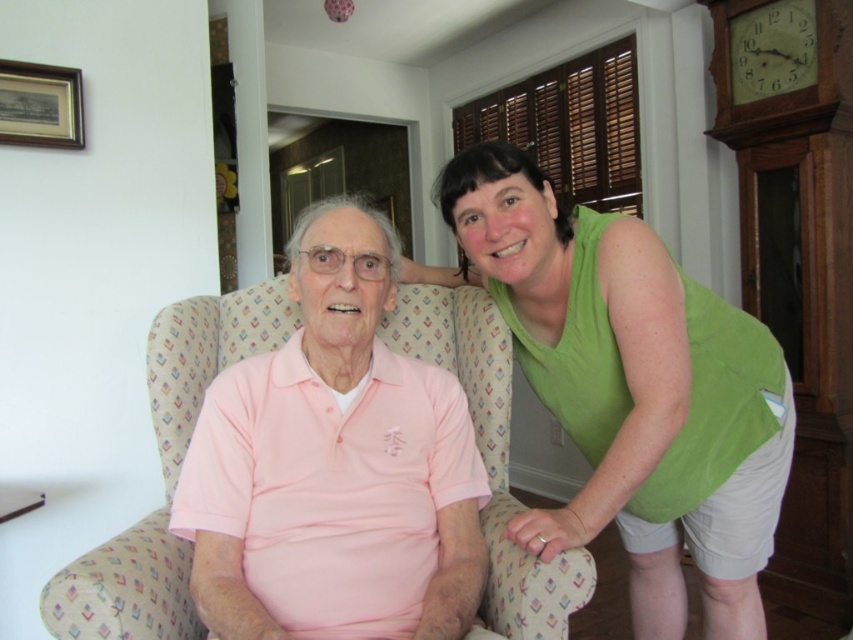
Who is lower down, green sleeveless top at upper right or wooden clock at upper right?

Positioned lower is green sleeveless top at upper right.

Does green sleeveless top at upper right appear on the right side of wooden clock at upper right?

In fact, green sleeveless top at upper right is to the left of wooden clock at upper right.

Identify the location of green sleeveless top at upper right. The height and width of the screenshot is (640, 853). (631, 388).

You are a GUI agent. You are given a task and a screenshot of the screen. Output one action in this format:
    pyautogui.click(x=<x>, y=<y>)
    Task: Click on the green sleeveless top at upper right
    
    Given the screenshot: What is the action you would take?
    pyautogui.click(x=631, y=388)

Based on the photo, is pink fabric armchair at center to the right of wooden clock at upper right from the viewer's perspective?

No, pink fabric armchair at center is not to the right of wooden clock at upper right.

Find the location of a particular element. The height and width of the screenshot is (640, 853). pink fabric armchair at center is located at coordinates (165, 472).

Who is more forward, (474, 364) or (746, 20)?

Point (474, 364) is in front.

At what (x,y) coordinates should I click in order to perform the action: click on pink fabric armchair at center. Please return your answer as a coordinate pair (x, y). The image size is (853, 640). Looking at the image, I should click on (165, 472).

From the picture: Does green sleeveless top at upper right have a larger size compared to pink fabric armchair at center?

Yes, green sleeveless top at upper right is bigger than pink fabric armchair at center.

Is point (640, 564) closer to camera compared to point (213, 342)?

That is False.

You are a GUI agent. You are given a task and a screenshot of the screen. Output one action in this format:
    pyautogui.click(x=<x>, y=<y>)
    Task: Click on the green sleeveless top at upper right
    This screenshot has width=853, height=640.
    Given the screenshot: What is the action you would take?
    pyautogui.click(x=631, y=388)